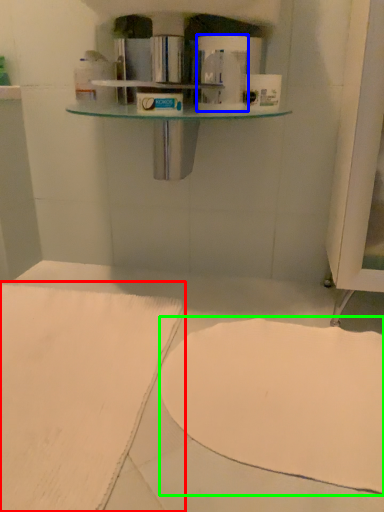
Question: Which object is positioned farthest from sheet (highlighted by a red box)? Select from toilet paper (highlighted by a blue box) and wide (highlighted by a green box).

Choices:
 (A) toilet paper
 (B) wide

Answer: (A)